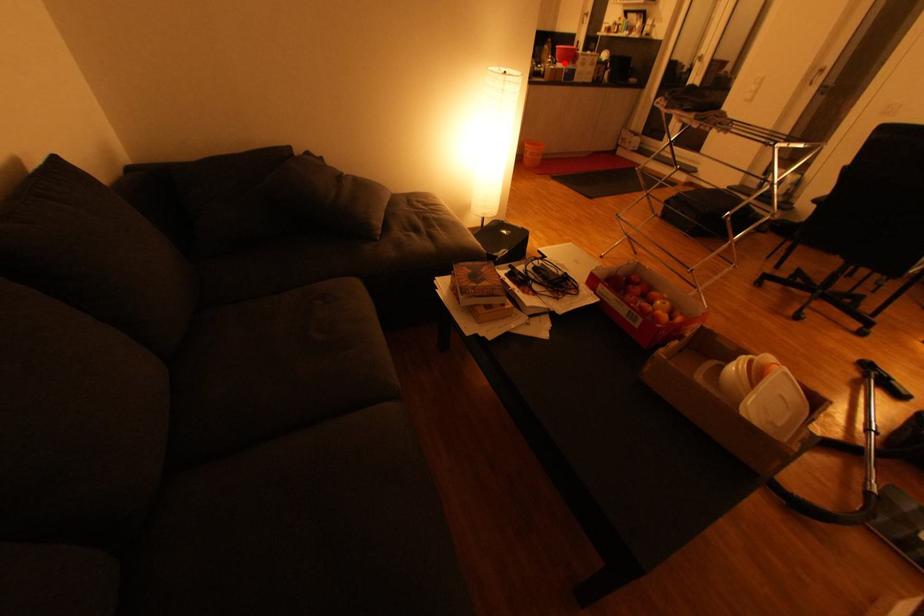
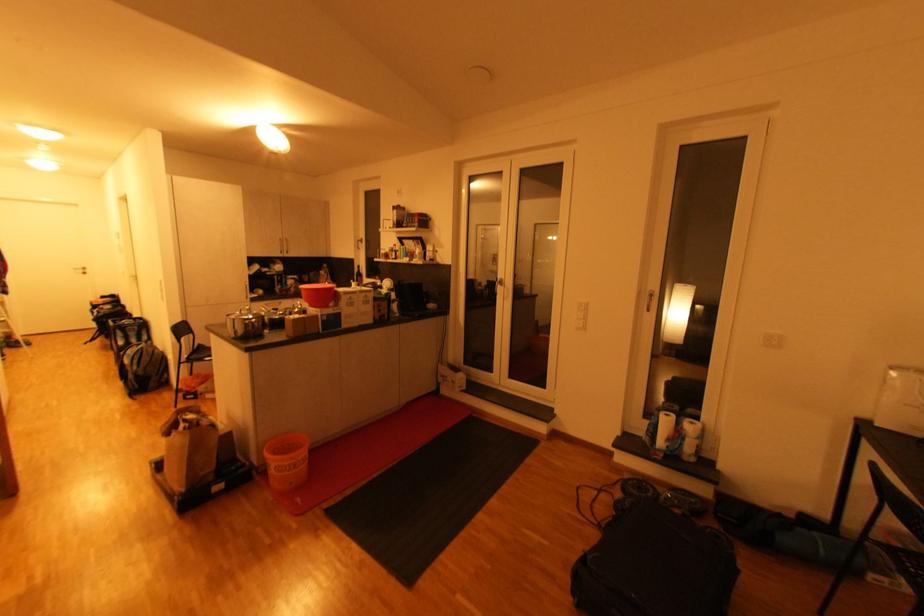
In the second image, find the point that corresponds to the highlighted location in the first image.

(315, 307)